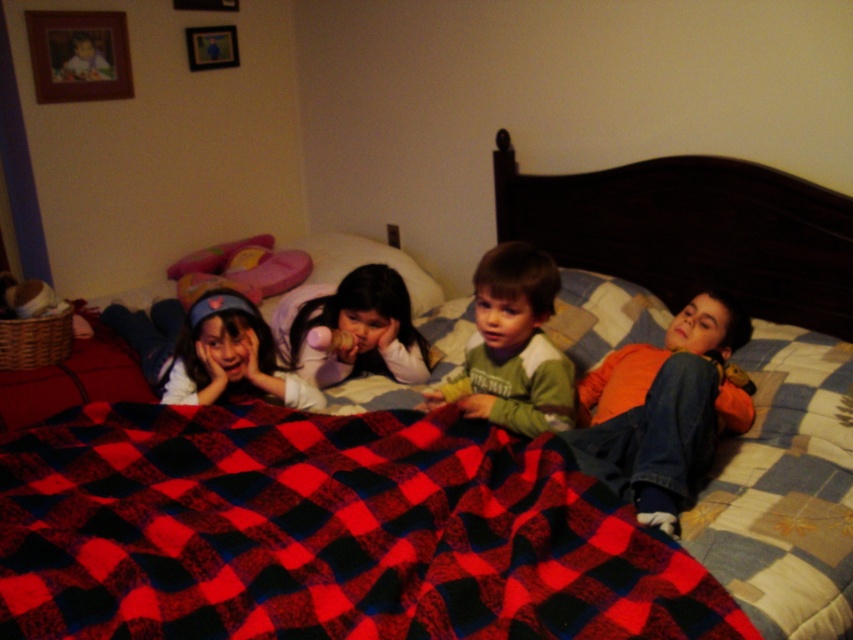
Looking at this image, is red plaid blanket at center bigger than metallic silver picture frame at upper center?

Yes.

Is point (312, 536) farther from camera compared to point (222, 67)?

No.

Does point (526, 627) come in front of point (229, 29)?

Yes, point (526, 627) is closer to viewer.

Identify the location of red plaid blanket at center. This screenshot has width=853, height=640. (326, 532).

Describe the element at coordinates (514, 348) in the screenshot. This screenshot has height=640, width=853. I see `green cotton shirt at center` at that location.

Who is taller, green cotton shirt at center or wooden picture frame at upper left?

Standing taller between the two is green cotton shirt at center.

This screenshot has height=640, width=853. Describe the element at coordinates (514, 348) in the screenshot. I see `green cotton shirt at center` at that location.

The image size is (853, 640). Find the location of `green cotton shirt at center`. green cotton shirt at center is located at coordinates (514, 348).

Is point (555, 384) farther from camera compared to point (326, 248)?

That is False.

Is green cotton shirt at center to the left of pink fabric pillow at center from the viewer's perspective?

Incorrect, green cotton shirt at center is not on the left side of pink fabric pillow at center.

Does point (529, 410) come closer to viewer compared to point (421, 300)?

Yes, point (529, 410) is in front of point (421, 300).

Locate an element on the screen. The image size is (853, 640). green cotton shirt at center is located at coordinates (514, 348).